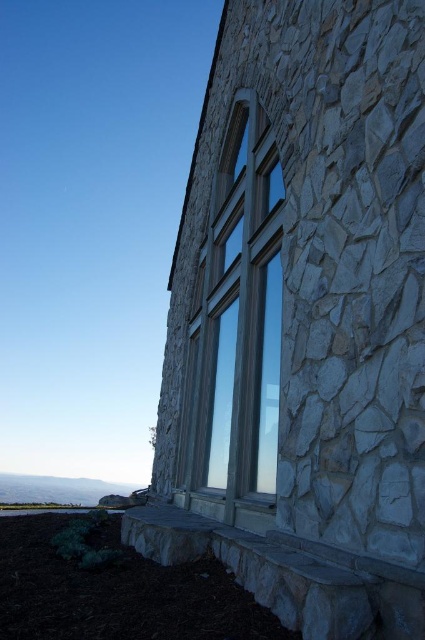
Question: Which point is closer to the camera?

Choices:
 (A) clear glass window at center
 (B) gray rough stone at center

Answer: (B)

Question: Is gray rough stone at center below clear glass window at center?

Choices:
 (A) no
 (B) yes

Answer: (B)

Question: Which object is closer to the camera taking this photo?

Choices:
 (A) gray rough stone at center
 (B) clear glass window at center

Answer: (A)

Question: Does gray rough stone at center have a lesser width compared to clear glass window at center?

Choices:
 (A) yes
 (B) no

Answer: (B)

Question: Which point is closer to the camera taking this photo?

Choices:
 (A) (235, 124)
 (B) (336, 81)

Answer: (B)

Question: Is gray rough stone at center in front of clear glass window at center?

Choices:
 (A) yes
 (B) no

Answer: (A)